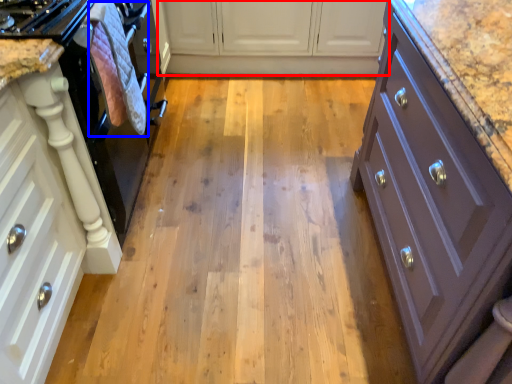
Question: Among these objects, which one is farthest to the camera, cabinetry (highlighted by a red box) or material (highlighted by a blue box)?

Choices:
 (A) cabinetry
 (B) material

Answer: (A)